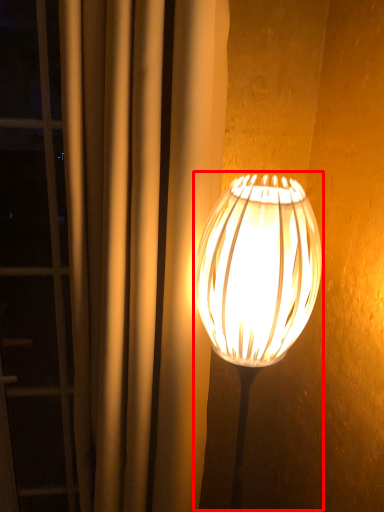
Question: Observing the image, what is the correct spatial positioning of lamp (annotated by the red box) in reference to curtain?

Choices:
 (A) right
 (B) left

Answer: (A)